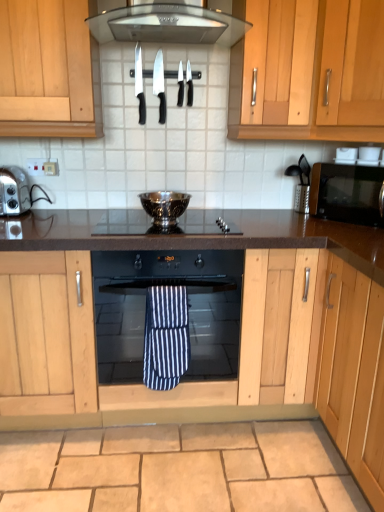
Question: In terms of height, does blue striped towel at center look taller or shorter compared to black glass oven at center?

Choices:
 (A) tall
 (B) short

Answer: (B)

Question: Is point (165, 353) positioned closer to the camera than point (215, 371)?

Choices:
 (A) farther
 (B) closer

Answer: (B)

Question: Which object is positioned closest to the silver metallic bowl at center?

Choices:
 (A) black glass oven at center
 (B) black glossy microwave at right
 (C) black plastic knife at upper center, the fourth knife viewed from the right
 (D) light wood cabinet at upper right
 (E) black plastic knife at upper center, marked as the 3th knife in a right-to-left arrangement

Answer: (A)

Question: Which object is the farthest from the stainless steel range hood at upper center?

Choices:
 (A) black plastic knife at upper center, which is the fourth knife from left to right
 (B) silver metallic toaster at left
 (C) black glass oven at center
 (D) blue striped towel at center
 (E) polished stainless steel knife at center, the 2th knife in the right-to-left sequence

Answer: (D)